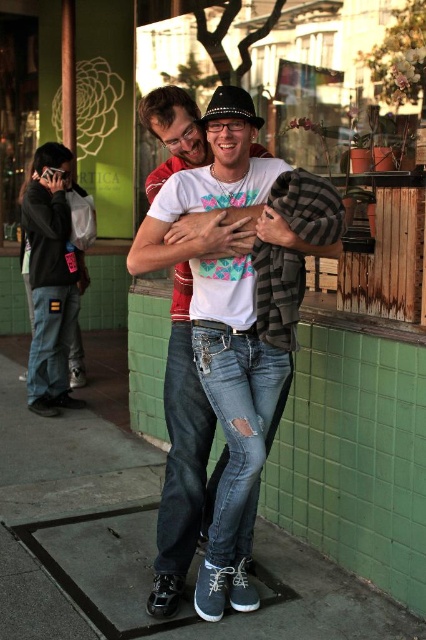
You are standing at the point labeled as point [230,612]. You want to walk to the rough concrete sidewalk at center. Which direction should you go?

You are already standing on the rough concrete sidewalk at center since the point [230,612] represents its location.

You are standing at point [230,612]. What is the surface you are standing on?

The surface at point [230,612] is rough concrete sidewalk at center.